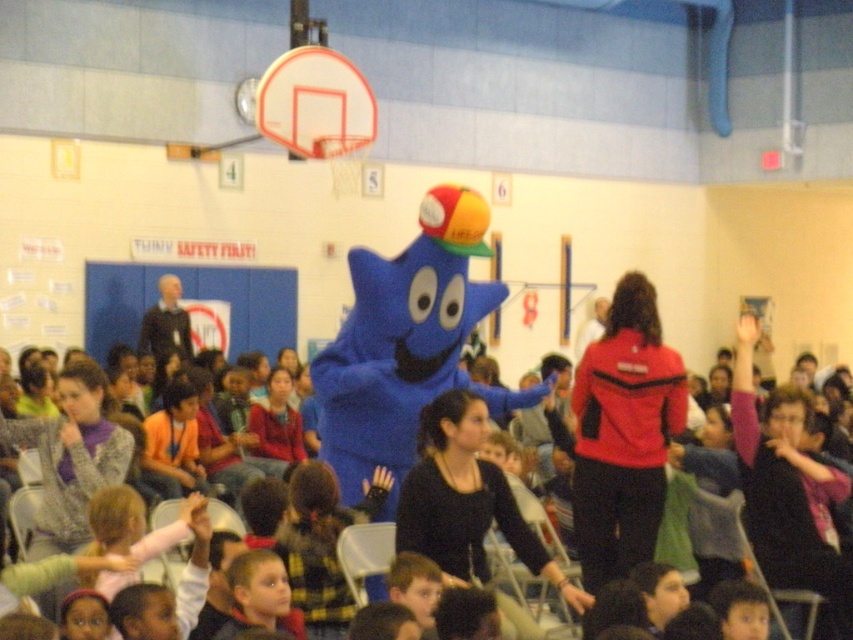
Is point (398, 406) farther from viewer compared to point (485, 212)?

No, it is in front of (485, 212).

Can you confirm if blue plush mascot at center is thinner than yellow rubber basketball at center?

Incorrect, blue plush mascot at center's width is not less than yellow rubber basketball at center's.

Which is in front, point (657, 467) or point (480, 209)?

Point (657, 467)

The height and width of the screenshot is (640, 853). Find the location of `blue plush mascot at center`. blue plush mascot at center is located at coordinates (399, 369).